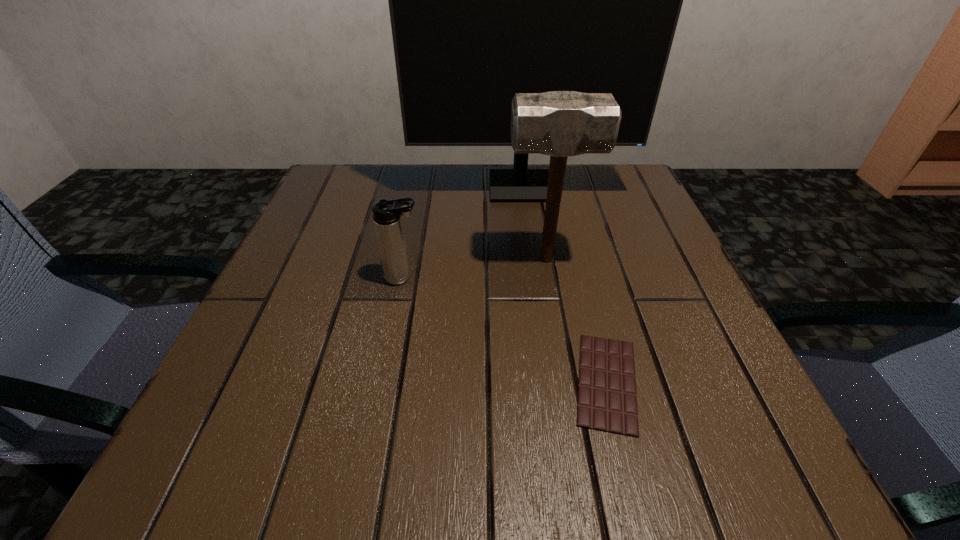
Locate an element on the screen. vacant region between the mallet and the nearest object is located at coordinates (577, 321).

You are a GUI agent. You are given a task and a screenshot of the screen. Output one action in this format:
    pyautogui.click(x=<x>, y=<y>)
    Task: Click on the vacant area between the mallet and the third tallest object
    The width and height of the screenshot is (960, 540).
    Given the screenshot: What is the action you would take?
    pyautogui.click(x=474, y=268)

Find the location of a particular element. The image size is (960, 540). vacant area that lies between the third shortest object and the farthest object is located at coordinates (533, 224).

I want to click on empty space that is in between the third shortest object and the thermos bottle, so click(x=474, y=268).

The width and height of the screenshot is (960, 540). In order to click on free space between the nearest object and the third shortest object in this screenshot , I will do `click(577, 321)`.

At what (x,y) coordinates should I click in order to perform the action: click on object that is the nearest to the second tallest object. Please return your answer as a coordinate pair (x, y). The image size is (960, 540). Looking at the image, I should click on (387, 213).

Identify the location of object that is the third closest to the tallest object. (607, 400).

Image resolution: width=960 pixels, height=540 pixels. I want to click on free location that satisfies the following two spatial constraints: 1. on the front-facing side of the tallest object; 2. on the right side of the shortest object, so click(545, 382).

I want to click on free spot that satisfies the following two spatial constraints: 1. on the striking face of the mallet; 2. on the left side of the nearest object, so click(x=567, y=382).

Image resolution: width=960 pixels, height=540 pixels. Find the location of `free location that satisfies the following two spatial constraints: 1. on the handle side of the nearest object; 2. on the right side of the thermos bottle`. free location that satisfies the following two spatial constraints: 1. on the handle side of the nearest object; 2. on the right side of the thermos bottle is located at coordinates (383, 382).